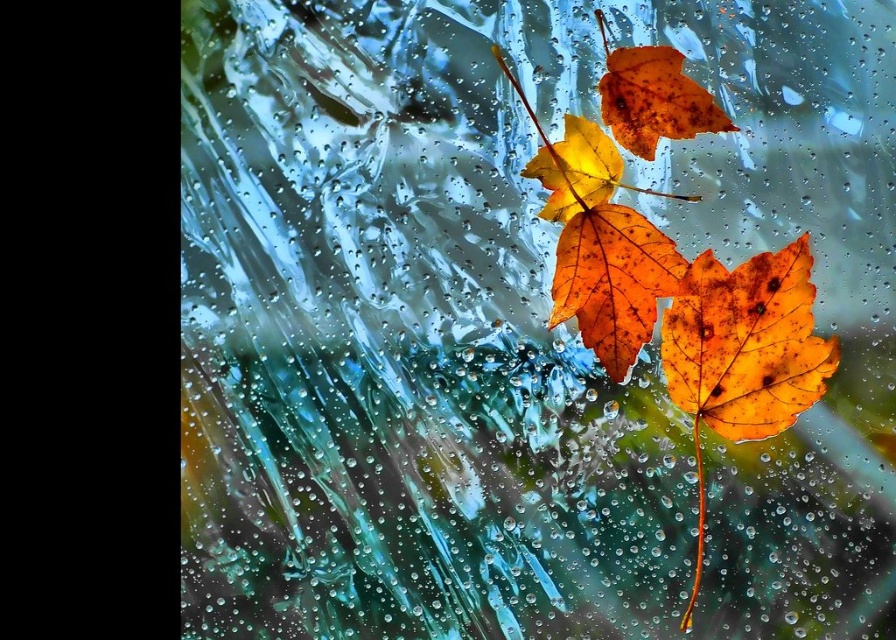
Who is positioned more to the left, shiny orange leaves at center or matte orange leaf at center?

Positioned to the left is shiny orange leaves at center.

What do you see at coordinates (678, 305) in the screenshot?
I see `shiny orange leaves at center` at bounding box center [678, 305].

Where is `shiny orange leaves at center`? Image resolution: width=896 pixels, height=640 pixels. shiny orange leaves at center is located at coordinates (678, 305).

Who is taller, matte orange leaf at center or rustic brown leaf at upper center?

Standing taller between the two is matte orange leaf at center.

Which is in front, point (721, 337) or point (662, 81)?

Point (721, 337) is more forward.

Where is `matte orange leaf at center`? matte orange leaf at center is located at coordinates (746, 342).

Does shiny orange leaves at center appear over orange matte maple leaf at center?

Yes.

Image resolution: width=896 pixels, height=640 pixels. Find the location of `shiny orange leaves at center`. shiny orange leaves at center is located at coordinates (678, 305).